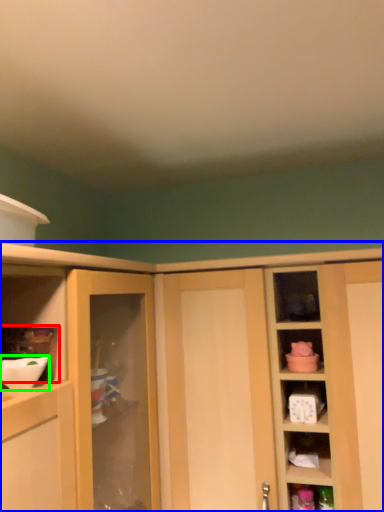
Question: Which object is positioned farthest from shelf (highlighted by a red box)? Select from cabinetry (highlighted by a blue box) and mixing bowl (highlighted by a green box).

Choices:
 (A) cabinetry
 (B) mixing bowl

Answer: (A)